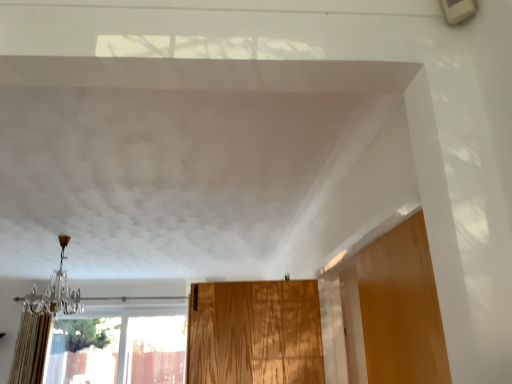
Question: From a real-world perspective, is beige textured curtain at left physically above crystal glass chandelier at left?

Choices:
 (A) yes
 (B) no

Answer: (B)

Question: Is beige textured curtain at left facing towards crystal glass chandelier at left?

Choices:
 (A) yes
 (B) no

Answer: (B)

Question: Is beige textured curtain at left facing away from crystal glass chandelier at left?

Choices:
 (A) no
 (B) yes

Answer: (A)

Question: Does beige textured curtain at left have a greater height compared to crystal glass chandelier at left?

Choices:
 (A) yes
 (B) no

Answer: (A)

Question: Does beige textured curtain at left come in front of crystal glass chandelier at left?

Choices:
 (A) no
 (B) yes

Answer: (A)

Question: Considering the relative positions of crystal glass chandelier at left and beige textured curtain at left in the image provided, is crystal glass chandelier at left to the left or to the right of beige textured curtain at left?

Choices:
 (A) right
 (B) left

Answer: (A)

Question: From the image's perspective, relative to beige textured curtain at left, is crystal glass chandelier at left above or below?

Choices:
 (A) above
 (B) below

Answer: (A)

Question: In terms of size, does crystal glass chandelier at left appear bigger or smaller than beige textured curtain at left?

Choices:
 (A) small
 (B) big

Answer: (A)

Question: In terms of height, does crystal glass chandelier at left look taller or shorter compared to beige textured curtain at left?

Choices:
 (A) short
 (B) tall

Answer: (A)

Question: Based on their positions, is transparent glass window at lower left located to the left or right of crystal glass chandelier at left?

Choices:
 (A) right
 (B) left

Answer: (B)

Question: From the image's perspective, relative to crystal glass chandelier at left, is transparent glass window at lower left above or below?

Choices:
 (A) above
 (B) below

Answer: (B)

Question: Relative to crystal glass chandelier at left, is transparent glass window at lower left in front or behind?

Choices:
 (A) front
 (B) behind

Answer: (B)

Question: Is point (140, 307) positioned closer to the camera than point (44, 301)?

Choices:
 (A) farther
 (B) closer

Answer: (A)

Question: Is beige textured curtain at left inside the boundaries of crystal glass chandelier at left, or outside?

Choices:
 (A) inside
 (B) outside

Answer: (B)

Question: Visually, is beige textured curtain at left positioned to the left or to the right of crystal glass chandelier at left?

Choices:
 (A) right
 (B) left

Answer: (B)